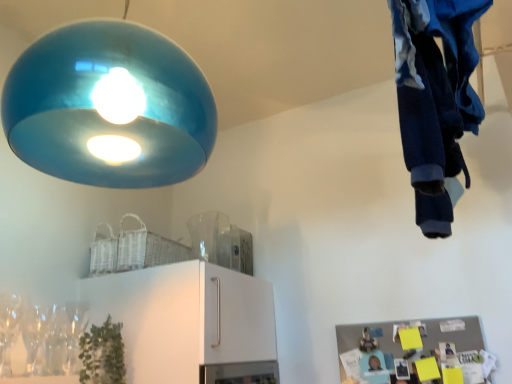
Question: In the image, is glossy blue lampshade at upper left positioned in front of or behind clear glass wine glass at lower left?

Choices:
 (A) front
 (B) behind

Answer: (A)

Question: Based on their sizes in the image, would you say glossy blue lampshade at upper left is bigger or smaller than clear glass wine glass at lower left?

Choices:
 (A) small
 (B) big

Answer: (B)

Question: Based on their relative distances, which object is nearer to the clear glass wine glass at lower left?

Choices:
 (A) green matte plant at lower left
 (B) blue cotton pants at upper right
 (C) glossy blue lampshade at upper left

Answer: (A)

Question: Based on their relative distances, which object is farther from the glossy blue lampshade at upper left?

Choices:
 (A) clear glass wine glass at lower left
 (B) blue cotton pants at upper right
 (C) green matte plant at lower left

Answer: (B)